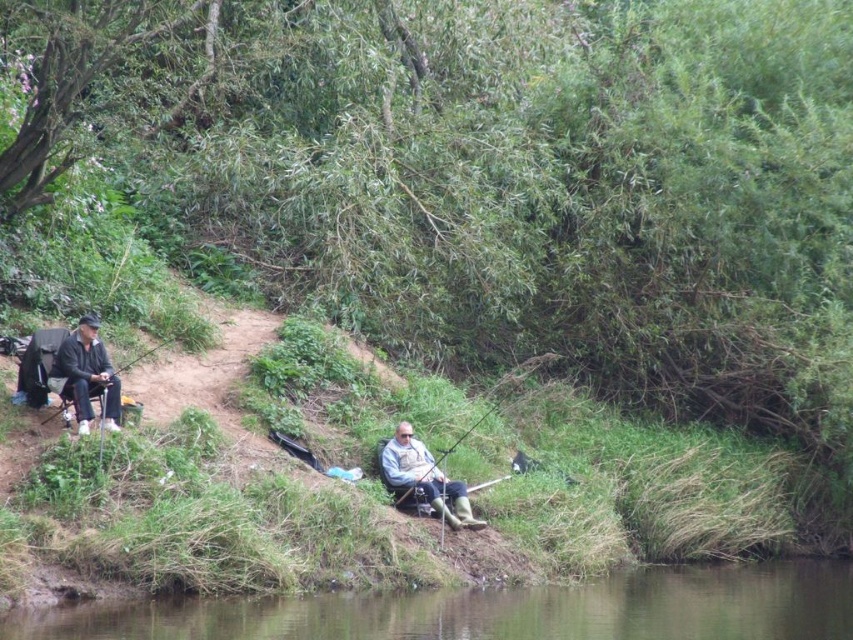
Between point (68, 372) and point (86, 349), which one is positioned in front?

Point (68, 372) is in front.

Does matte black jacket at left have a greater height compared to matte black fishing rod at left?

Correct, matte black jacket at left is much taller as matte black fishing rod at left.

At what (x,y) coordinates should I click in order to perform the action: click on matte black jacket at left. Please return your answer as a coordinate pair (x, y). This screenshot has width=853, height=640. Looking at the image, I should click on (86, 374).

Locate an element on the screen. This screenshot has height=640, width=853. matte black jacket at left is located at coordinates (86, 374).

Can you confirm if matte black jacket at left is positioned below light gray fabric jacket at center?

Incorrect, matte black jacket at left is not positioned below light gray fabric jacket at center.

Does matte black jacket at left appear on the left side of light gray fabric jacket at center?

Indeed, matte black jacket at left is positioned on the left side of light gray fabric jacket at center.

This screenshot has width=853, height=640. I want to click on matte black jacket at left, so click(x=86, y=374).

Can you confirm if green grass at lower center is bigger than light gray fabric jacket at center?

Correct, green grass at lower center is larger in size than light gray fabric jacket at center.

Looking at this image, who is shorter, green grass at lower center or light gray fabric jacket at center?

With less height is green grass at lower center.

Is point (32, 621) positioned behind point (393, 456)?

No.

What are the coordinates of `green grass at lower center` in the screenshot? It's located at (500, 611).